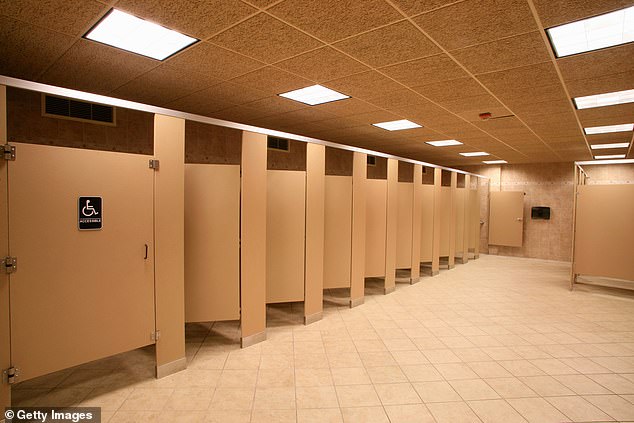
At what (x,y) coordinates should I click in order to perform the action: click on vent. Please return your answer as a coordinate pair (x, y). The image size is (634, 423). Looking at the image, I should click on (77, 121), (283, 147), (375, 161), (427, 172).